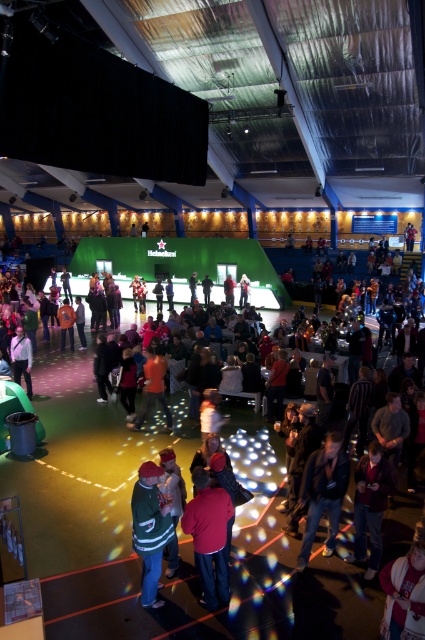
Question: Is the position of red fabric jacket at center less distant than that of dark blue jeans at lower right?

Choices:
 (A) yes
 (B) no

Answer: (A)

Question: Among these objects, which one is nearest to the camera?

Choices:
 (A) orange matte shirt at center
 (B) denim jacket at lower right
 (C) light brown leather jacket at lower left

Answer: (B)

Question: Which point is closer to the camera?

Choices:
 (A) denim jacket at lower right
 (B) light brown leather jacket at lower left

Answer: (A)

Question: Estimate the real-world distances between objects in this image. Which object is farther from the white fleece jacket at lower right?

Choices:
 (A) orange matte shirt at center
 (B) orange cotton shirt at center
 (C) red fabric jacket at center
 (D) green jersey at center

Answer: (B)

Question: Is denim jacket at lower right above orange cotton shirt at center?

Choices:
 (A) yes
 (B) no

Answer: (B)

Question: Can you confirm if red fabric jacket at center is positioned above white fleece jacket at lower right?

Choices:
 (A) no
 (B) yes

Answer: (B)